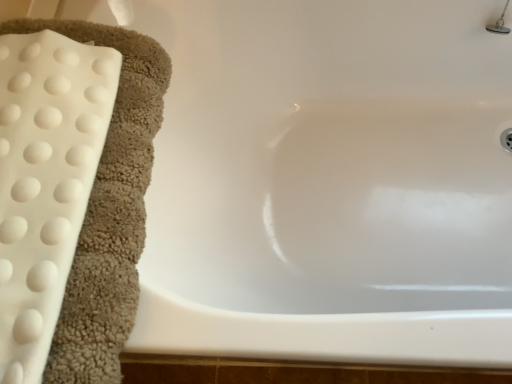
You are a GUI agent. You are given a task and a screenshot of the screen. Output one action in this format:
    pyautogui.click(x=<x>, y=<y>)
    Task: Click on the beige fluffy bath towel at left
    This screenshot has width=512, height=384.
    Given the screenshot: What is the action you would take?
    pyautogui.click(x=109, y=210)

Image resolution: width=512 pixels, height=384 pixels. What do you see at coordinates (109, 210) in the screenshot? I see `beige fluffy bath towel at left` at bounding box center [109, 210].

Where is `beige fluffy bath towel at left`? Image resolution: width=512 pixels, height=384 pixels. beige fluffy bath towel at left is located at coordinates (109, 210).